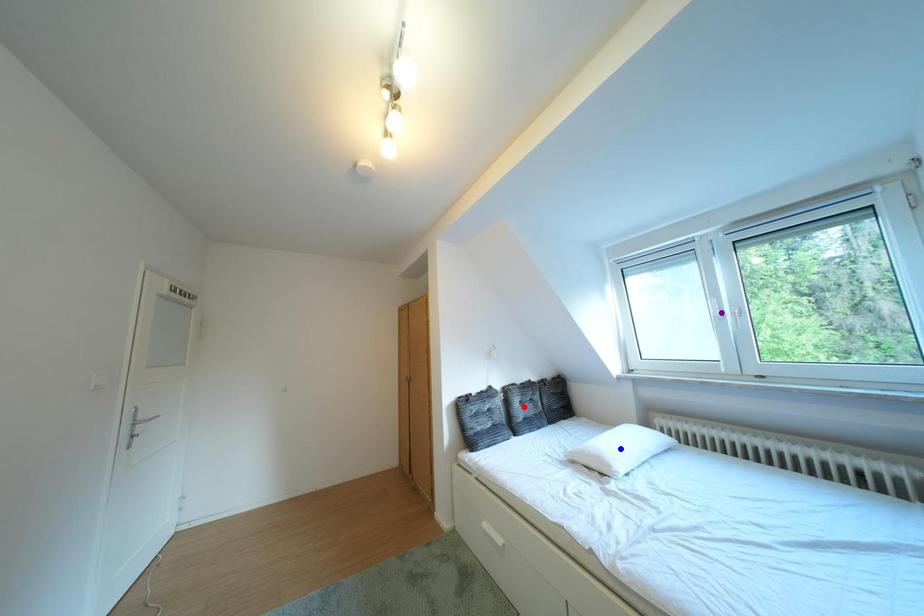
Order these from farthest to nearest:
A) blue point
B) red point
C) purple point

red point → purple point → blue point